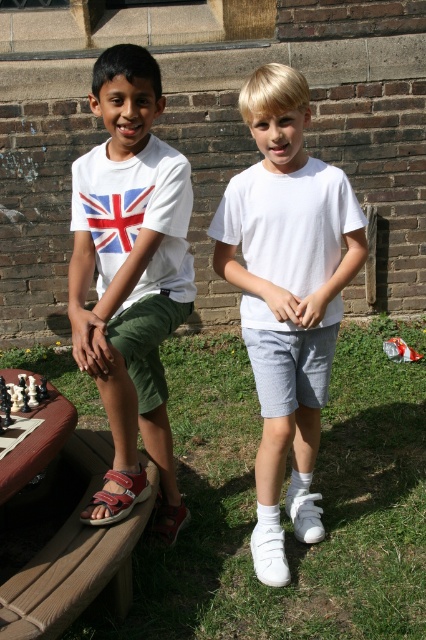
Question: Is white matte shorts at center bigger than matte white t-shirt at left?

Choices:
 (A) no
 (B) yes

Answer: (B)

Question: Does white matte shorts at center appear under matte white t-shirt at left?

Choices:
 (A) yes
 (B) no

Answer: (A)

Question: Which object is farther from the camera taking this photo?

Choices:
 (A) white matte shorts at center
 (B) matte white t-shirt at left

Answer: (A)

Question: Which object is farther from the camera taking this photo?

Choices:
 (A) white matte shorts at center
 (B) matte white t-shirt at left

Answer: (A)

Question: Is white matte shorts at center closer to the viewer compared to matte white t-shirt at left?

Choices:
 (A) yes
 (B) no

Answer: (B)

Question: Which point is farther from the camera taking this photo?

Choices:
 (A) tap(250, 209)
 (B) tap(115, 428)

Answer: (A)